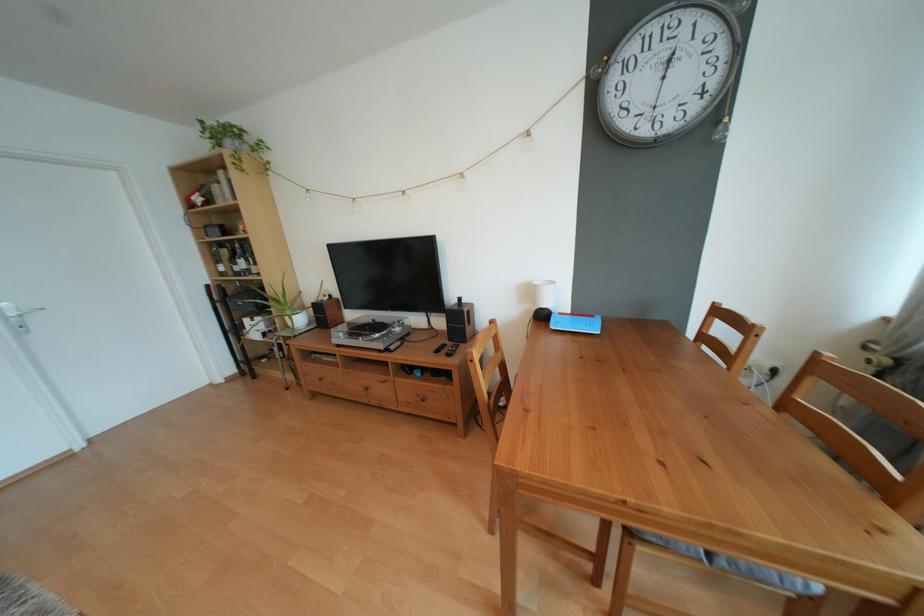
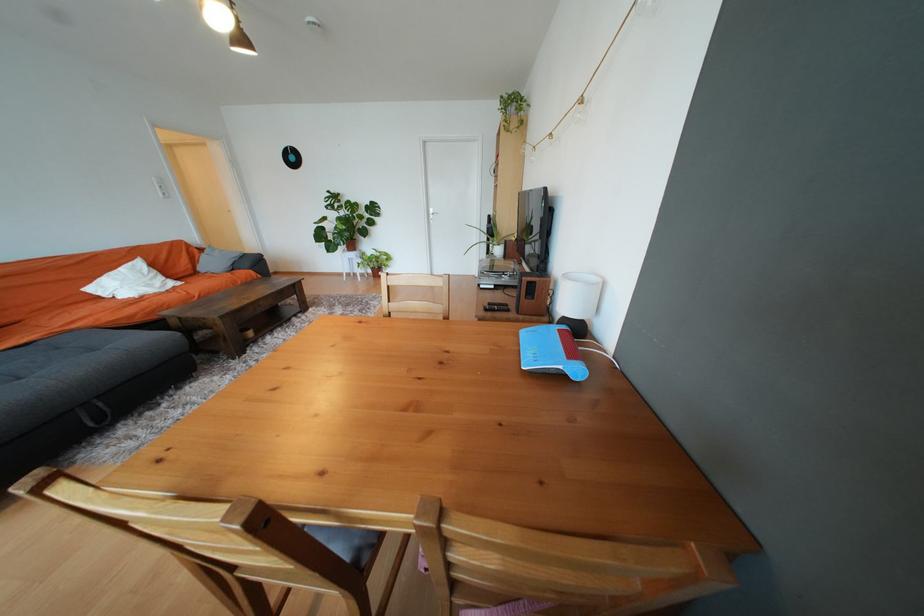
In the second image, find the point that corresponds to [410,337] in the first image.

(517, 288)